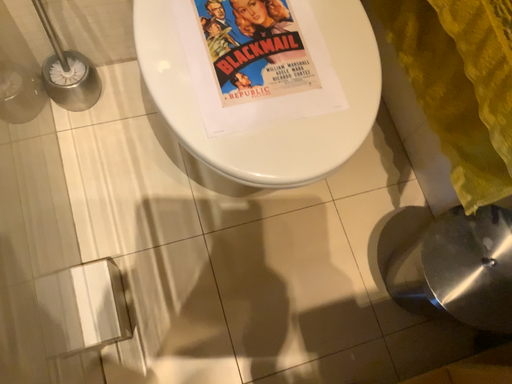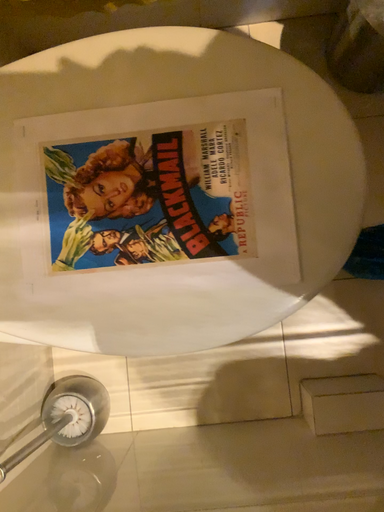
Question: How did the camera likely rotate when shooting the video?

Choices:
 (A) rotated downward
 (B) rotated upward

Answer: (A)